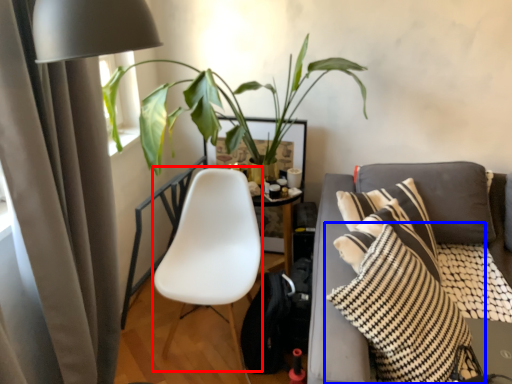
Question: Which object is further to the camera taking this photo, rocking chair (highlighted by a red box) or pillow (highlighted by a blue box)?

Choices:
 (A) rocking chair
 (B) pillow

Answer: (A)